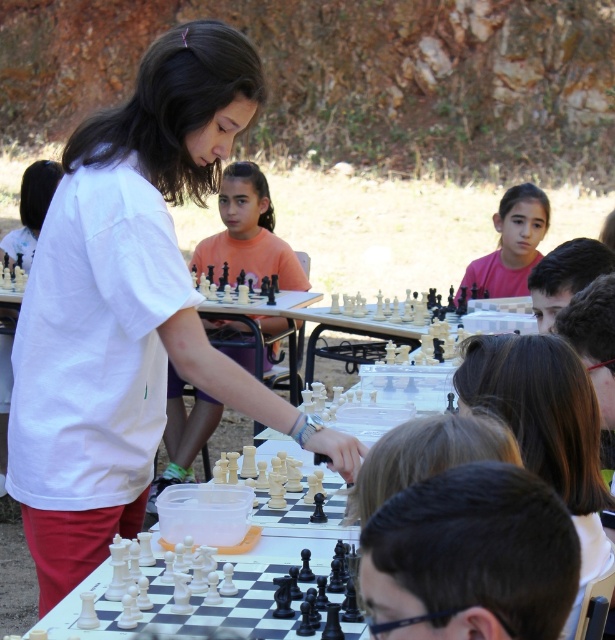
Between matte white chess set at center and pink matte shirt at upper center, which one appears on the left side from the viewer's perspective?

matte white chess set at center is more to the left.

Is matte white chess set at center wider than pink matte shirt at upper center?

Correct, the width of matte white chess set at center exceeds that of pink matte shirt at upper center.

Which is behind, point (220, 410) or point (458, 289)?

Point (220, 410)

Where is `matte white chess set at center`? matte white chess set at center is located at coordinates (247, 232).

Does white matte shirt at center lie in front of matte white chess set at center?

Yes, it is in front of matte white chess set at center.

Is point (62, 413) more distant than point (284, 275)?

That is False.

Identify the location of white matte shirt at center. (129, 307).

Measure the distance between white matte shirt at center and camera.

white matte shirt at center and camera are 9.42 feet apart from each other.

Can you confirm if white matte shirt at center is positioned below pink matte shirt at upper center?

Yes.

Which is behind, point (105, 289) or point (514, 269)?

The point (514, 269) is behind.

The image size is (615, 640). I want to click on white matte shirt at center, so click(129, 307).